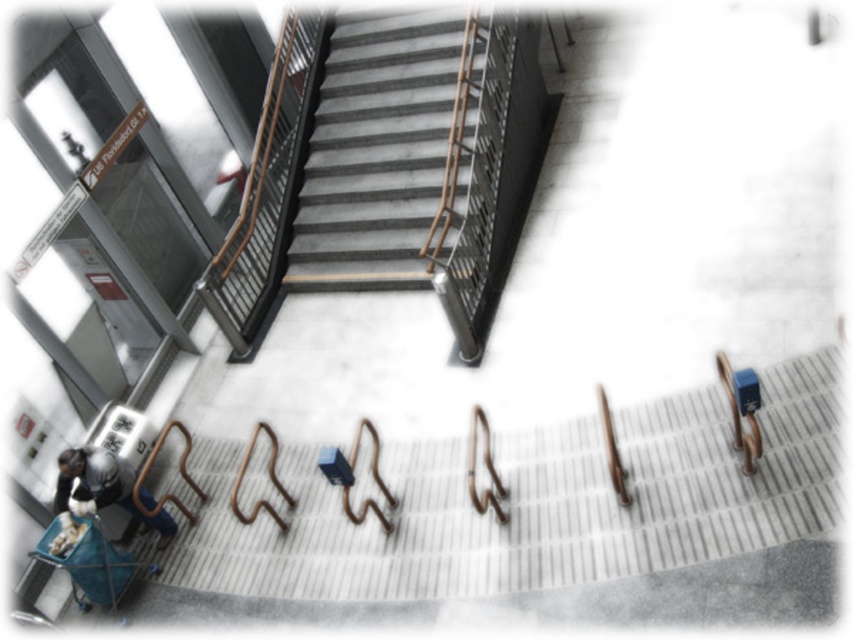
You are a delivery person carrying a large package and need to navigate the gray concrete stairs at center and the dark gray fabric bag at lower left. Which object is located above the other?

The gray concrete stairs at center is positioned over dark gray fabric bag at lower left, so the stairs are above the bag.

You are a delivery person carrying a package and need to reach the subway entrance shown in the image. You see the gray concrete stairs at center and the dark gray fabric bag at lower left. Which object is closer to you, the delivery person?

The dark gray fabric bag at lower left is closer to you than the gray concrete stairs at center because the stairs are further away from the viewer.